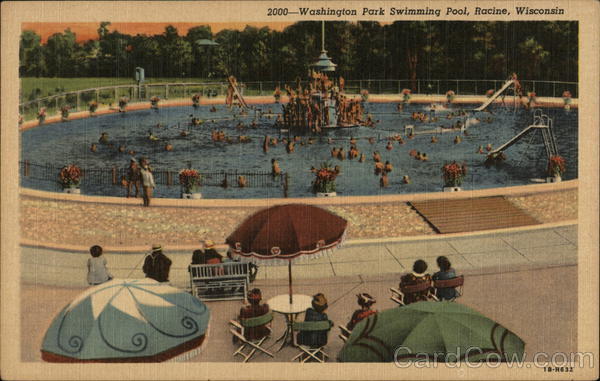
Identify the location of singular chair seating. The image size is (600, 381). (253, 343), (306, 350), (345, 330), (401, 300), (448, 298).